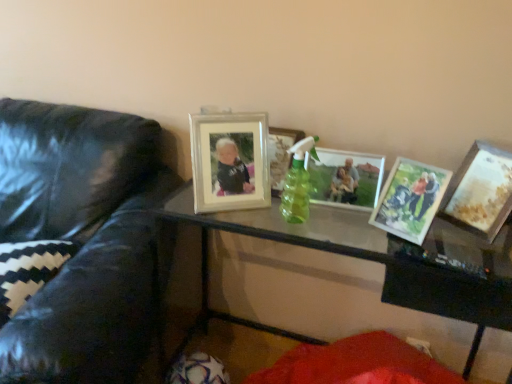
How much space does matte silver picture frame at center, the 2th picture frame when ordered from left to right, occupy horizontally?

It is 6.33 inches.

The height and width of the screenshot is (384, 512). What do you see at coordinates (230, 161) in the screenshot?
I see `white glossy picture frame at upper center, which is the first picture frame from left to right` at bounding box center [230, 161].

Locate an element on the screen. black zigzag-patterned pillow at left is located at coordinates (28, 270).

What do you see at coordinates (28, 270) in the screenshot? Image resolution: width=512 pixels, height=384 pixels. I see `black zigzag-patterned pillow at left` at bounding box center [28, 270].

The image size is (512, 384). Describe the element at coordinates (410, 199) in the screenshot. I see `matte wooden picture frame at center right, the fourth picture frame from the left` at that location.

In order to face matte wooden picture frame at center right, the fourth picture frame from the left, should I rotate leftwards or rightwards?

You should rotate right by 20.191 degrees.

At what (x,y) coordinates should I click in order to perform the action: click on transparent glass table at center. Please return your answer as a coordinate pair (x, y). Looking at the image, I should click on (378, 259).

The height and width of the screenshot is (384, 512). Identify the location of matte silver picture frame at center, the 2th picture frame when ordered from left to right. (281, 155).

Considering the points (54, 104) and (22, 274), which point is behind, point (54, 104) or point (22, 274)?

The point (54, 104) is farther.

From a real-world perspective, is black leather couch at left physically above black zigzag-patterned pillow at left?

No, from a real-world perspective, black leather couch at left is not over black zigzag-patterned pillow at left

How different are the orientations of black leather couch at left and black zigzag-patterned pillow at left in degrees?

The facing directions of black leather couch at left and black zigzag-patterned pillow at left are 3.25 degrees apart.

Would you say black zigzag-patterned pillow at left is part of black leather couch at left's contents?

Yes, black zigzag-patterned pillow at left can be found within black leather couch at left.

Between matte silver picture frame at center, marked as the 4th picture frame in a right-to-left arrangement, and black leather couch at left, which one has less height?

Standing shorter between the two is matte silver picture frame at center, marked as the 4th picture frame in a right-to-left arrangement.

Looking at their sizes, would you say matte silver picture frame at center, the 2th picture frame when ordered from left to right, is wider or thinner than black leather couch at left?

In the image, matte silver picture frame at center, the 2th picture frame when ordered from left to right, appears to be more narrow than black leather couch at left.

Can we say matte silver picture frame at center, the 2th picture frame when ordered from left to right, lies outside black leather couch at left?

matte silver picture frame at center, the 2th picture frame when ordered from left to right, is positioned outside black leather couch at left.

Is matte silver picture frame at center, the 2th picture frame when ordered from left to right, next to black leather couch at left and touching it?

No, matte silver picture frame at center, the 2th picture frame when ordered from left to right, is not touching black leather couch at left.

Which is behind, point (32, 370) or point (423, 233)?

Positioned behind is point (423, 233).

Is black leather couch at left wider than matte wooden picture frame at center right, which appears as the 2th picture frame when viewed from the right?

Yes.

What's the angular difference between black leather couch at left and matte wooden picture frame at center right, the fourth picture frame from the left,'s facing directions?

They differ by 30.3 degrees in their facing directions.

Is black leather couch at left in front of or behind matte wooden picture frame at center right, the fourth picture frame from the left, in the image?

In the image, black leather couch at left appears in front of matte wooden picture frame at center right, the fourth picture frame from the left.

Is wooden photo frame at right, the fifth picture frame when ordered from left to right, positioned with its back to transparent glass table at center?

No, wooden photo frame at right, the fifth picture frame when ordered from left to right, is not facing away from transparent glass table at center.

From the image's perspective, is wooden photo frame at right, the fifth picture frame when ordered from left to right, above or below transparent glass table at center?

Based on their image positions, wooden photo frame at right, the fifth picture frame when ordered from left to right, is located above transparent glass table at center.

Which is less distant, (483, 214) or (362, 236)?

Point (483, 214).

Is wooden photo frame at right, the fifth picture frame when ordered from left to right, directly adjacent to transparent glass table at center?

No, wooden photo frame at right, the fifth picture frame when ordered from left to right, is not touching transparent glass table at center.

Which of these two, matte glass photo frame at center, which is the 3th picture frame from left to right, or white glossy picture frame at upper center, marked as the 5th picture frame in a right-to-left arrangement, is smaller?

Smaller between the two is matte glass photo frame at center, which is the 3th picture frame from left to right.

How different are the orientations of matte glass photo frame at center, which is the 3th picture frame from left to right, and white glossy picture frame at upper center, marked as the 5th picture frame in a right-to-left arrangement, in degrees?

They differ by 31.5 degrees in their facing directions.

Considering their positions, is matte glass photo frame at center, the third picture frame positioned from the right, located in front of or behind white glossy picture frame at upper center, which is the first picture frame from left to right?

Clearly, matte glass photo frame at center, the third picture frame positioned from the right, is behind white glossy picture frame at upper center, which is the first picture frame from left to right.

Does matte glass photo frame at center, which is the 3th picture frame from left to right, appear on the left side of white glossy picture frame at upper center, which is the first picture frame from left to right?

In fact, matte glass photo frame at center, which is the 3th picture frame from left to right, is to the right of white glossy picture frame at upper center, which is the first picture frame from left to right.

Based on the photo, does matte silver picture frame at center, the 2th picture frame when ordered from left to right, have a greater width compared to wooden photo frame at right, the first picture frame positioned from the right?

Incorrect, the width of matte silver picture frame at center, the 2th picture frame when ordered from left to right, does not surpass that of wooden photo frame at right, the first picture frame positioned from the right.

Does matte silver picture frame at center, the 2th picture frame when ordered from left to right, lie behind wooden photo frame at right, the fifth picture frame when ordered from left to right?

Yes, it is behind wooden photo frame at right, the fifth picture frame when ordered from left to right.

Is matte silver picture frame at center, the 2th picture frame when ordered from left to right, inside the boundaries of wooden photo frame at right, the fifth picture frame when ordered from left to right, or outside?

matte silver picture frame at center, the 2th picture frame when ordered from left to right, is located beyond the bounds of wooden photo frame at right, the fifth picture frame when ordered from left to right.

From a real-world perspective, is matte wooden picture frame at center right, which appears as the 2th picture frame when viewed from the right, physically above white glossy picture frame at upper center, marked as the 5th picture frame in a right-to-left arrangement?

No, from a real-world perspective, matte wooden picture frame at center right, which appears as the 2th picture frame when viewed from the right, is not above white glossy picture frame at upper center, marked as the 5th picture frame in a right-to-left arrangement.

Which is less distant, (396, 219) or (267, 163)?

The point (396, 219) is closer to the camera.

There is a matte wooden picture frame at center right, the fourth picture frame from the left. Where is `the 4th picture frame above it (from the image's perspective)`? This screenshot has width=512, height=384. the 4th picture frame above it (from the image's perspective) is located at coordinates (230, 161).

Considering the sizes of objects matte wooden picture frame at center right, the fourth picture frame from the left, and white glossy picture frame at upper center, marked as the 5th picture frame in a right-to-left arrangement, in the image provided, who is taller, matte wooden picture frame at center right, the fourth picture frame from the left, or white glossy picture frame at upper center, marked as the 5th picture frame in a right-to-left arrangement,?

white glossy picture frame at upper center, marked as the 5th picture frame in a right-to-left arrangement.

Locate an element on the screen. This screenshot has width=512, height=384. studio couch lying on the left of black zigzag-patterned pillow at left is located at coordinates (81, 239).

Locate an element on the screen. studio couch below the matte silver picture frame at center, marked as the 4th picture frame in a right-to-left arrangement (from a real-world perspective) is located at coordinates (81, 239).

Based on the photo, looking at the image, which one is located further to wooden photo frame at right, the fifth picture frame when ordered from left to right, white glossy picture frame at upper center, which is the first picture frame from left to right, or transparent glass table at center?

white glossy picture frame at upper center, which is the first picture frame from left to right.

When comparing their distances from matte silver picture frame at center, the 2th picture frame when ordered from left to right, does transparent glass table at center or black zigzag-patterned pillow at left seem further?

black zigzag-patterned pillow at left is further to matte silver picture frame at center, the 2th picture frame when ordered from left to right.

Based on their spatial positions, is matte wooden picture frame at center right, which appears as the 2th picture frame when viewed from the right, or white glossy picture frame at upper center, marked as the 5th picture frame in a right-to-left arrangement, further from black zigzag-patterned pillow at left?

matte wooden picture frame at center right, which appears as the 2th picture frame when viewed from the right, is further to black zigzag-patterned pillow at left.

Which object lies nearer to the anchor point matte wooden picture frame at center right, which appears as the 2th picture frame when viewed from the right, white glossy picture frame at upper center, which is the first picture frame from left to right, or black leather couch at left?

white glossy picture frame at upper center, which is the first picture frame from left to right, is closer to matte wooden picture frame at center right, which appears as the 2th picture frame when viewed from the right.

Estimate the real-world distances between objects in this image. Which object is closer to white glossy picture frame at upper center, which is the first picture frame from left to right, matte silver picture frame at center, marked as the 4th picture frame in a right-to-left arrangement, or wooden photo frame at right, the first picture frame positioned from the right?

matte silver picture frame at center, marked as the 4th picture frame in a right-to-left arrangement, lies closer to white glossy picture frame at upper center, which is the first picture frame from left to right, than the other object.

Looking at the image, which one is located further to matte glass photo frame at center, the third picture frame positioned from the right, wooden photo frame at right, the first picture frame positioned from the right, or transparent glass table at center?

The object further to matte glass photo frame at center, the third picture frame positioned from the right, is transparent glass table at center.

Which object lies further to the anchor point white glossy picture frame at upper center, marked as the 5th picture frame in a right-to-left arrangement, wooden photo frame at right, the first picture frame positioned from the right, or black zigzag-patterned pillow at left?

Among the two, wooden photo frame at right, the first picture frame positioned from the right, is located further to white glossy picture frame at upper center, marked as the 5th picture frame in a right-to-left arrangement.

Considering their positions, is matte silver picture frame at center, the 2th picture frame when ordered from left to right, positioned further to black leather couch at left than black zigzag-patterned pillow at left?

matte silver picture frame at center, the 2th picture frame when ordered from left to right.

This screenshot has height=384, width=512. What are the coordinates of `table between black leather couch at left and matte glass photo frame at center, which is the 3th picture frame from left to right` in the screenshot? It's located at point(378,259).

What are the coordinates of `table between black zigzag-patterned pillow at left and matte glass photo frame at center, which is the 3th picture frame from left to right, from left to right` in the screenshot? It's located at (378, 259).

This screenshot has height=384, width=512. Find the location of `pillow between black leather couch at left and wooden photo frame at right, the first picture frame positioned from the right`. pillow between black leather couch at left and wooden photo frame at right, the first picture frame positioned from the right is located at coordinates [x=28, y=270].

Where is `pillow located between black leather couch at left and transparent glass table at center in the left-right direction`? The image size is (512, 384). pillow located between black leather couch at left and transparent glass table at center in the left-right direction is located at coordinates (28, 270).